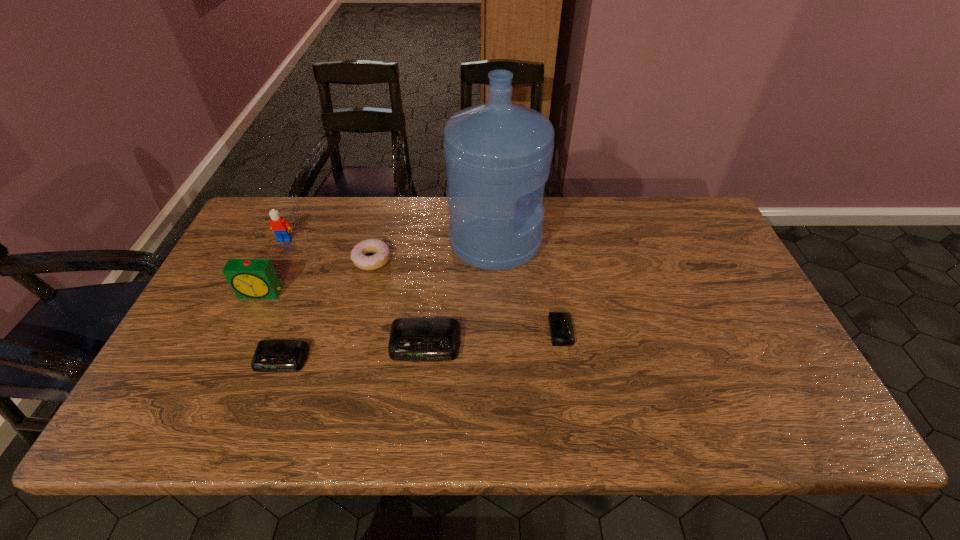
In order to click on vacant space that satisfies the following two spatial constraints: 1. on the side of the tallest object with the handle; 2. on the display of the third shortest alarm clock in this screenshot , I will do `click(499, 345)`.

The height and width of the screenshot is (540, 960). What are the coordinates of `free location that satisfies the following two spatial constraints: 1. on the display of the shortest object; 2. on the display of the third alarm clock from left to right` in the screenshot? It's located at (564, 345).

Image resolution: width=960 pixels, height=540 pixels. I want to click on free spot that satisfies the following two spatial constraints: 1. on the display of the shortest alarm clock; 2. on the display of the third object from left to right, so click(565, 360).

Where is `vacant space that satisfies the following two spatial constraints: 1. on the side of the tallest object with the handle; 2. on the front-facing side of the tallest alarm clock`? The height and width of the screenshot is (540, 960). vacant space that satisfies the following two spatial constraints: 1. on the side of the tallest object with the handle; 2. on the front-facing side of the tallest alarm clock is located at coordinates (497, 294).